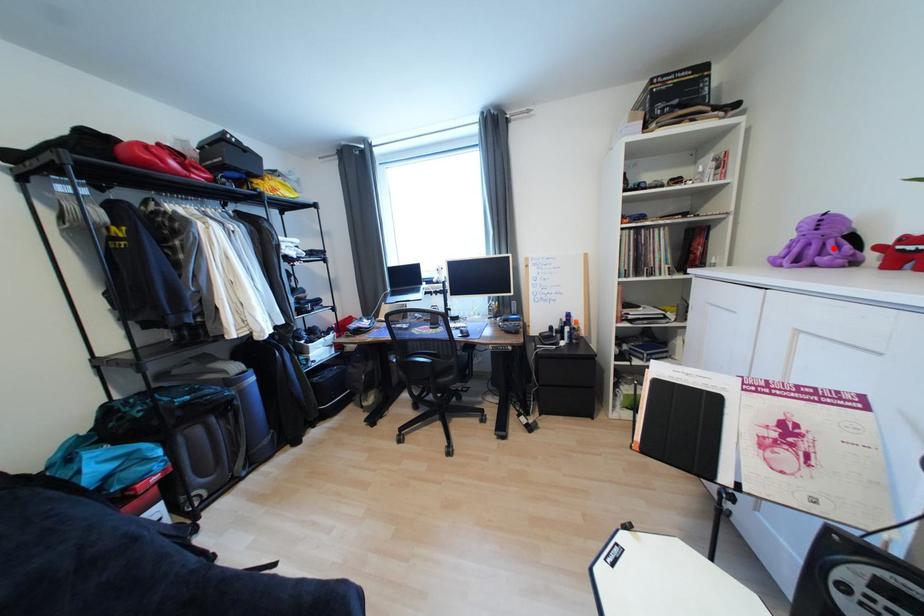
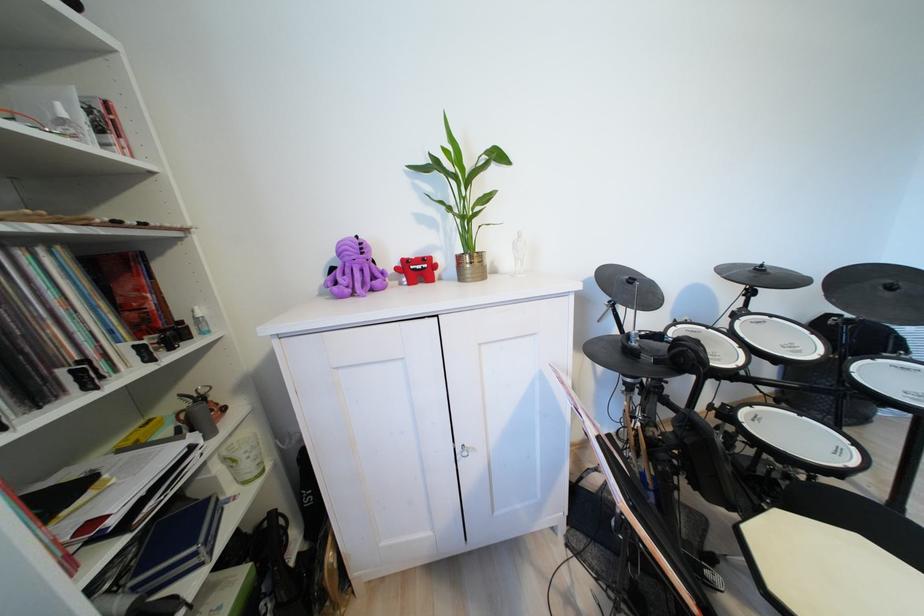
In the second image, find the point that corresponds to the highlighted location in the first image.

(360, 274)